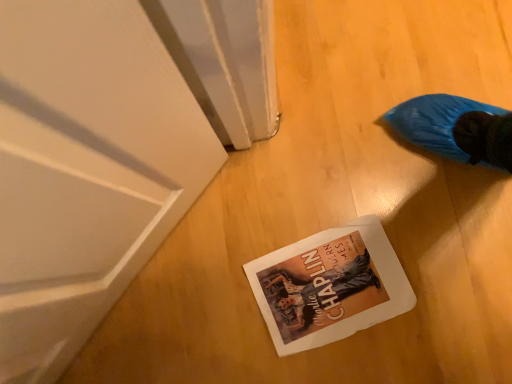
Find the location of a particular element. white paper book at center is located at coordinates (329, 286).

What do you see at coordinates (329, 286) in the screenshot?
I see `white paper book at center` at bounding box center [329, 286].

Where is `white paper book at center`? white paper book at center is located at coordinates (329, 286).